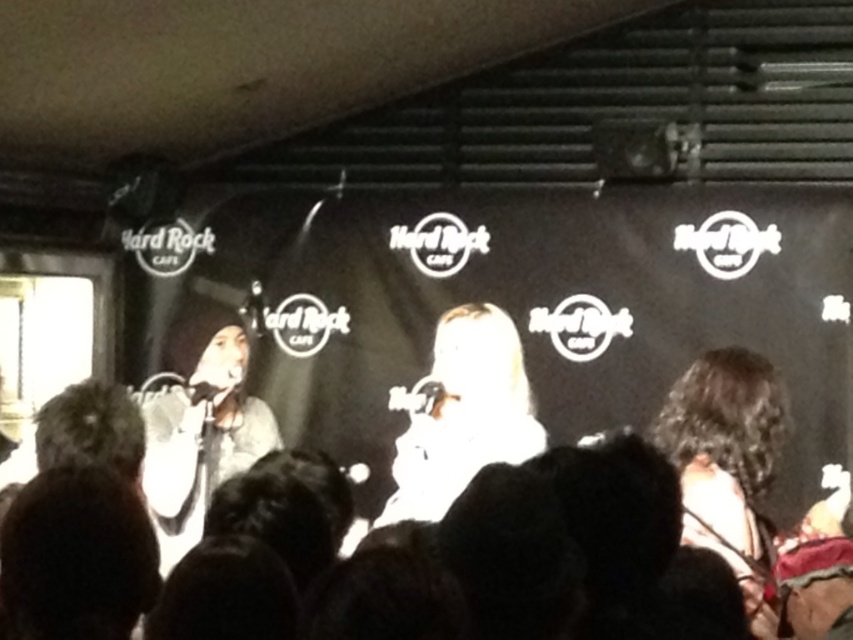
Does white matte microphone at center appear on the left side of matte black microphone at left?

Incorrect, white matte microphone at center is not on the left side of matte black microphone at left.

Does white matte microphone at center have a larger size compared to matte black microphone at left?

Incorrect, white matte microphone at center is not larger than matte black microphone at left.

Who is more distant from viewer, (427, 381) or (248, 413)?

The point (427, 381) is more distant.

What are the coordinates of `white matte microphone at center` in the screenshot? It's located at (462, 413).

Measure the distance from curly hair at right to white matte microphone at center.

curly hair at right is 29.60 inches away from white matte microphone at center.

Can you confirm if curly hair at right is wider than white matte microphone at center?

No, curly hair at right is not wider than white matte microphone at center.

Describe the element at coordinates (726, 458) in the screenshot. The height and width of the screenshot is (640, 853). I see `curly hair at right` at that location.

Locate an element on the screen. This screenshot has width=853, height=640. curly hair at right is located at coordinates (726, 458).

Is curly hair at right above matte black microphone at left?

Correct, curly hair at right is located above matte black microphone at left.

Who is higher up, curly hair at right or matte black microphone at left?

curly hair at right

Does point (788, 417) lie behind point (169, 506)?

No, it is in front of (169, 506).

This screenshot has height=640, width=853. Find the location of `curly hair at right`. curly hair at right is located at coordinates (726, 458).